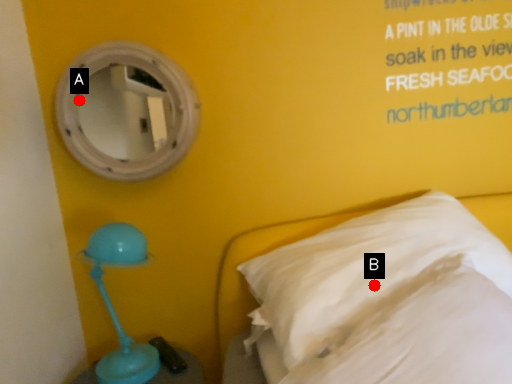
Question: Two points are circled on the image, labeled by A and B beside each circle. Which point appears farthest from the camera in this image?

Choices:
 (A) A is further
 (B) B is further

Answer: (A)